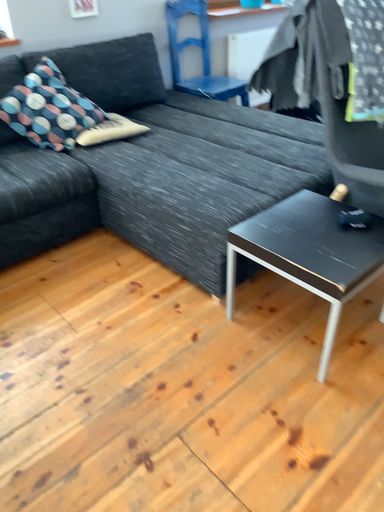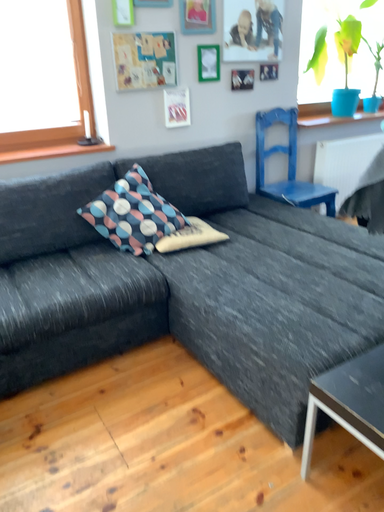
Question: Which way did the camera rotate in the video?

Choices:
 (A) rotated upward
 (B) rotated downward

Answer: (A)